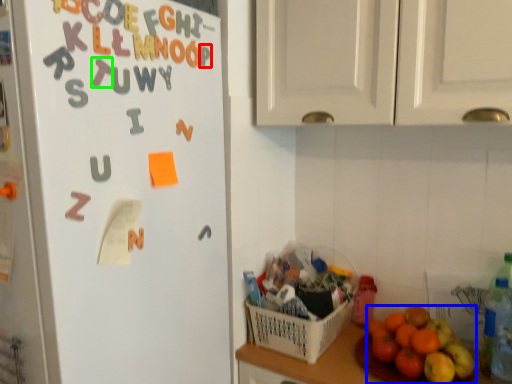
Question: Based on their relative distances, which object is nearer to letter (highlighted by a red box)? Choose from grapefruit (highlighted by a blue box) and alphabet (highlighted by a green box).

Choices:
 (A) grapefruit
 (B) alphabet

Answer: (B)